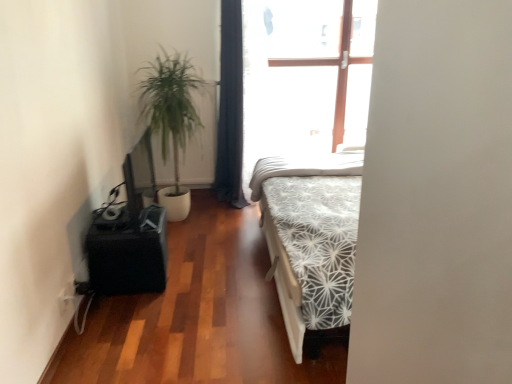
Question: From a real-world perspective, is green leafy plant at left positioned above or below white textured mattress at center?

Choices:
 (A) above
 (B) below

Answer: (A)

Question: Considering the positions of point (181, 99) and point (324, 162), is point (181, 99) closer or farther from the camera than point (324, 162)?

Choices:
 (A) closer
 (B) farther

Answer: (A)

Question: Which object is the closest to the black matte table at left?

Choices:
 (A) white textured mattress at center
 (B) green leafy plant at left
 (C) dark blue fabric curtain at center
 (D) white textured screen door at center

Answer: (A)

Question: Estimate the real-world distances between objects in this image. Which object is closer to the white textured mattress at center?

Choices:
 (A) white textured screen door at center
 (B) dark blue fabric curtain at center
 (C) black matte table at left
 (D) green leafy plant at left

Answer: (B)